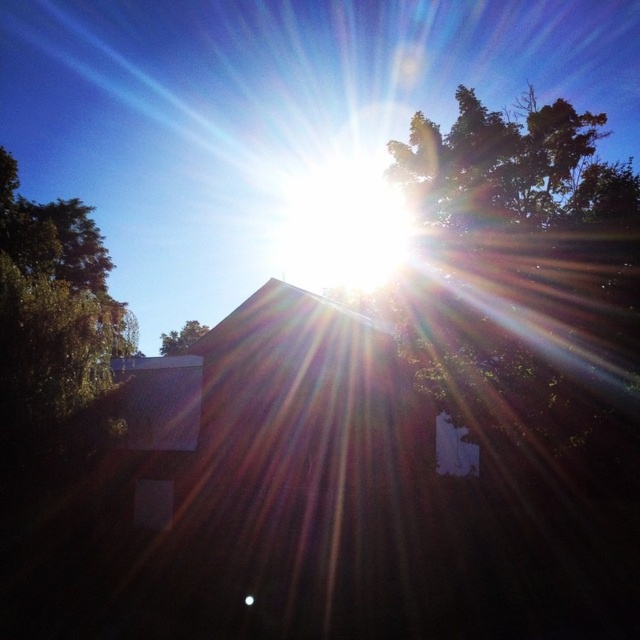
Question: Can you confirm if green leafy tree at upper right is positioned above green leafy tree at center?

Choices:
 (A) no
 (B) yes

Answer: (B)

Question: Among these objects, which one is nearest to the camera?

Choices:
 (A) green leafy tree at upper right
 (B) green leafy tree at left
 (C) green leafy tree at center

Answer: (A)

Question: Is green leafy tree at left below green leafy tree at center?

Choices:
 (A) yes
 (B) no

Answer: (B)

Question: Which of the following is the farthest from the observer?

Choices:
 (A) (177, 337)
 (B) (83, 225)
 (C) (564, 202)

Answer: (A)

Question: Which object is positioned farthest from the green leafy tree at center?

Choices:
 (A) green leafy tree at upper right
 (B) green leafy tree at left

Answer: (A)

Question: Can you confirm if green leafy tree at upper right is positioned to the left of green leafy tree at left?

Choices:
 (A) no
 (B) yes

Answer: (A)